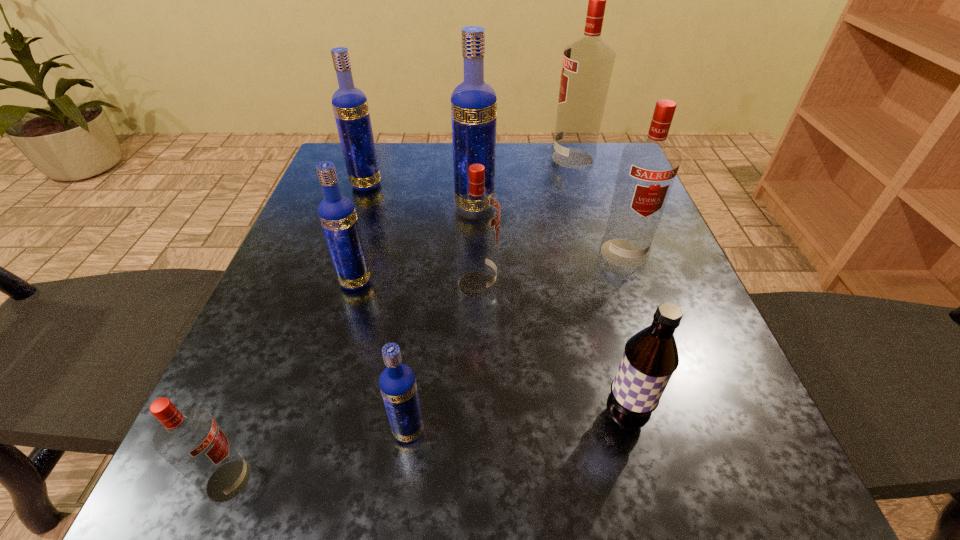
Where is `free space between the smallest red vodka and the third nearest blue vodka`? free space between the smallest red vodka and the third nearest blue vodka is located at coordinates [x=351, y=344].

Locate an element on the screen. This screenshot has width=960, height=540. free spot between the second nearest blue vodka and the root beer is located at coordinates [x=490, y=349].

You are a GUI agent. You are given a task and a screenshot of the screen. Output one action in this format:
    pyautogui.click(x=<x>, y=<y>)
    Task: Click on the vacant space that is in between the second smallest blue vodka and the nearest object
    
    Given the screenshot: What is the action you would take?
    pyautogui.click(x=292, y=381)

Locate an element on the screen. Image resolution: width=960 pixels, height=540 pixels. free spot between the farthest vodka and the smallest blue vodka is located at coordinates (491, 294).

The height and width of the screenshot is (540, 960). In order to click on free space that is in between the second smallest blue vodka and the fourth vodka from left to right in this screenshot , I will do `click(382, 356)`.

Image resolution: width=960 pixels, height=540 pixels. In order to click on vacant region between the nearest blue vodka and the third smallest red vodka in this screenshot , I will do `click(516, 342)`.

Image resolution: width=960 pixels, height=540 pixels. What are the coordinates of `vacant area that lies between the third red vodka from right to left and the root beer` in the screenshot? It's located at (551, 350).

Select which object is the second closest to the biggest blue vodka. Please provide its 2D coordinates. Your answer should be formatted as a tuple, i.e. [(x, y)], where the tuple contains the x and y coordinates of a point satisfying the conditions above.

[(350, 106)]

Locate an element on the screen. object that stands as the eighth closest to the smallest blue vodka is located at coordinates (587, 65).

At what (x,y) coordinates should I click in order to perform the action: click on vodka that is the second closest to the fourth farthest object. Please return your answer as a coordinate pair (x, y). Looking at the image, I should click on (473, 102).